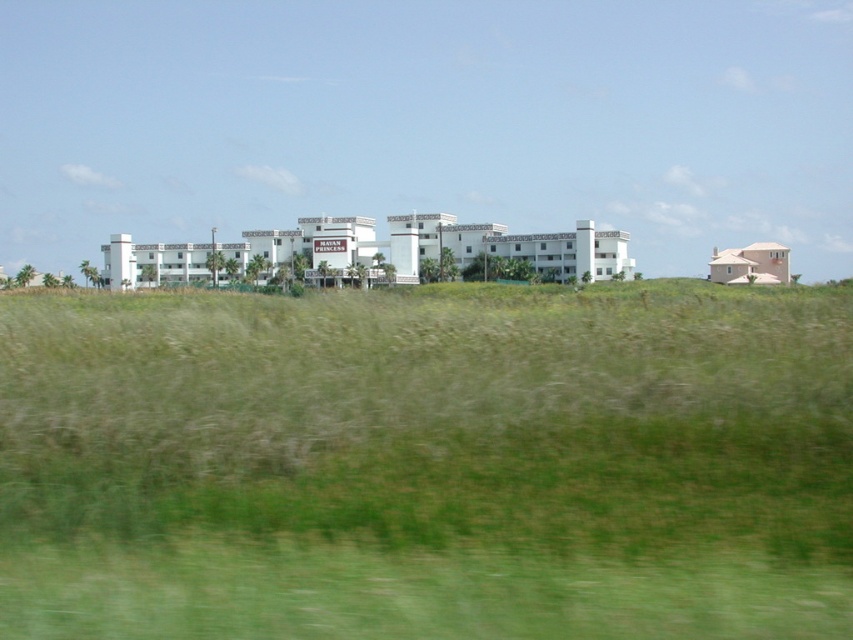
Between green grassy field at center and white matte building at center, which one is positioned lower?

green grassy field at center is below.

How far apart are green grassy field at center and white matte building at center?

A distance of 56.27 meters exists between green grassy field at center and white matte building at center.

Measure the distance between green grassy field at center and camera.

green grassy field at center is 5.56 meters away from camera.

The image size is (853, 640). What are the coordinates of `green grassy field at center` in the screenshot? It's located at (427, 461).

Is green grassy field at center positioned behind pink stucco house at right?

No, green grassy field at center is in front of pink stucco house at right.

In the scene shown: Between green grassy field at center and pink stucco house at right, which one appears on the right side from the viewer's perspective?

From the viewer's perspective, pink stucco house at right appears more on the right side.

Locate an element on the screen. green grassy field at center is located at coordinates (427, 461).

Which of these two, white matte building at center or pink stucco house at right, stands shorter?

With less height is white matte building at center.

Between white matte building at center and pink stucco house at right, which one appears on the right side from the viewer's perspective?

pink stucco house at right

Who is more forward, (465, 225) or (766, 264)?

Positioned in front is point (465, 225).

Find the location of a particular element. white matte building at center is located at coordinates (366, 252).